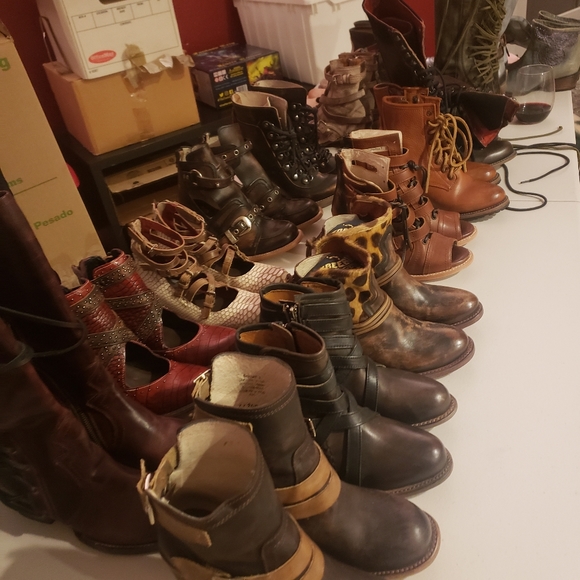
I want to click on floor, so click(x=496, y=433).